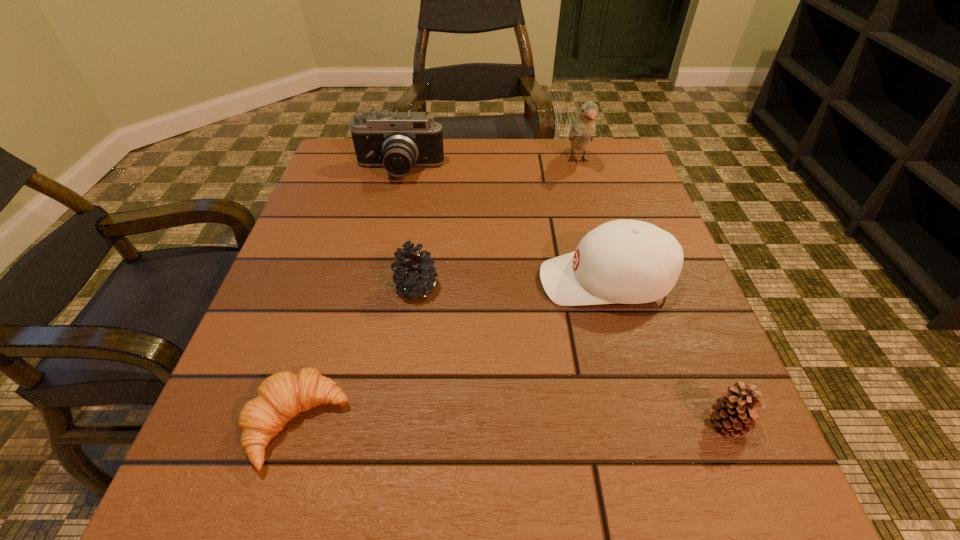
Identify the location of free location located 0.370m on the front-facing side of the baseball cap. This screenshot has height=540, width=960. (339, 281).

At what (x,y) coordinates should I click in order to perform the action: click on vacant region located 0.390m on the front-facing side of the baseball cap. Please return your answer as a coordinate pair (x, y). Looking at the image, I should click on (327, 281).

This screenshot has height=540, width=960. In order to click on vacant space situated 0.160m on the front-facing side of the baseball cap in this screenshot , I will do `click(452, 281)`.

Find the location of a particular element. The width and height of the screenshot is (960, 540). free space located on the back of the taller pinecone is located at coordinates (426, 218).

Where is `vacant area situated on the front of the shorter pinecone`? Image resolution: width=960 pixels, height=540 pixels. vacant area situated on the front of the shorter pinecone is located at coordinates (756, 490).

Where is `vacant point located on the right of the shortest object`? The height and width of the screenshot is (540, 960). vacant point located on the right of the shortest object is located at coordinates (546, 424).

Locate an element on the screen. This screenshot has height=540, width=960. bird located in the far edge section of the desktop is located at coordinates point(583,130).

Where is `camera at the far edge`? camera at the far edge is located at coordinates (397, 141).

Image resolution: width=960 pixels, height=540 pixels. Identify the location of object that is positioned at the near edge. (282, 396).

Identify the location of camera situated at the left edge. Image resolution: width=960 pixels, height=540 pixels. (397, 141).